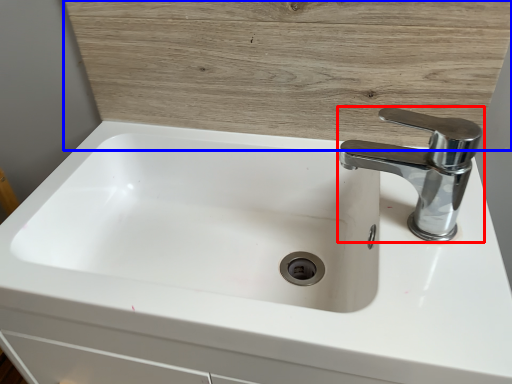
Question: Which object appears closest to the camera in this image, tap (highlighted by a red box) or wood (highlighted by a blue box)?

Choices:
 (A) tap
 (B) wood

Answer: (A)